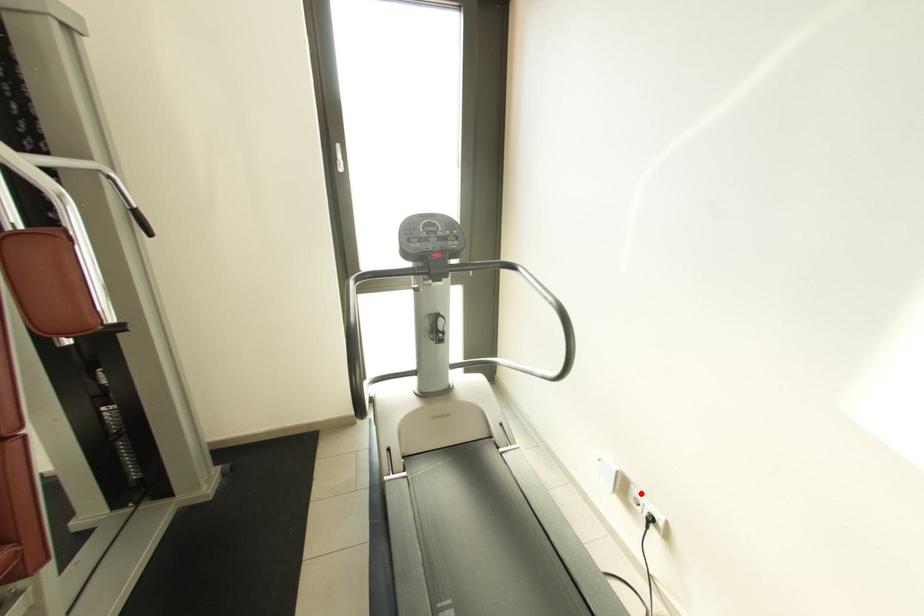
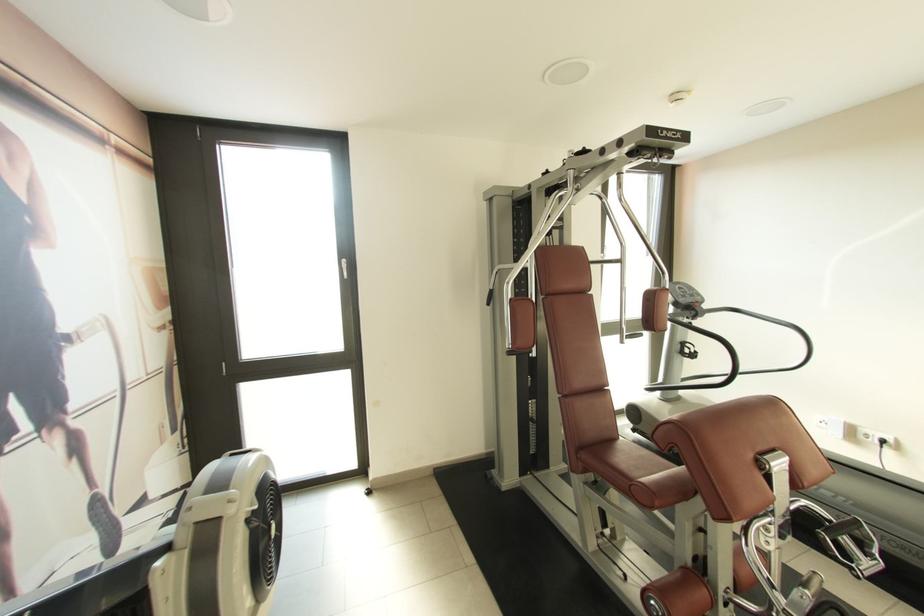
Question: A red point is marked in image1. In image2, is the corresponding 3D point closer to the camera or farther? Reply with the corresponding letter.

Choices:
 (A) The corresponding 3D point is closer.
 (B) The corresponding 3D point is farther.

Answer: (A)